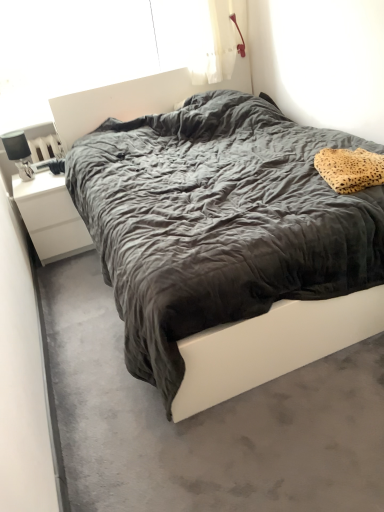
Question: Is white matte nightstand at left at the right side of velvet dark gray bed at center?

Choices:
 (A) yes
 (B) no

Answer: (B)

Question: Considering the relative sizes of white matte nightstand at left and velvet dark gray bed at center in the image provided, is white matte nightstand at left wider than velvet dark gray bed at center?

Choices:
 (A) yes
 (B) no

Answer: (B)

Question: Is velvet dark gray bed at center located within white matte nightstand at left?

Choices:
 (A) no
 (B) yes

Answer: (A)

Question: Is white matte nightstand at left shorter than velvet dark gray bed at center?

Choices:
 (A) yes
 (B) no

Answer: (A)

Question: Is white matte nightstand at left closer to camera compared to velvet dark gray bed at center?

Choices:
 (A) no
 (B) yes

Answer: (A)

Question: Is white matte nightstand at left thinner than velvet dark gray bed at center?

Choices:
 (A) no
 (B) yes

Answer: (B)

Question: From a real-world perspective, is velvet dark gray bed at center on top of matte black lamp at left?

Choices:
 (A) no
 (B) yes

Answer: (A)

Question: Is velvet dark gray bed at center facing towards matte black lamp at left?

Choices:
 (A) no
 (B) yes

Answer: (A)

Question: Is velvet dark gray bed at center touching matte black lamp at left?

Choices:
 (A) yes
 (B) no

Answer: (B)

Question: Can you confirm if velvet dark gray bed at center is bigger than matte black lamp at left?

Choices:
 (A) yes
 (B) no

Answer: (A)

Question: From the image's perspective, is velvet dark gray bed at center below matte black lamp at left?

Choices:
 (A) yes
 (B) no

Answer: (A)

Question: Is velvet dark gray bed at center completely or partially outside of matte black lamp at left?

Choices:
 (A) no
 (B) yes

Answer: (B)

Question: Considering the relative sizes of velvet dark gray bed at center and leopard print fabric pillow at upper right in the image provided, is velvet dark gray bed at center smaller than leopard print fabric pillow at upper right?

Choices:
 (A) no
 (B) yes

Answer: (A)